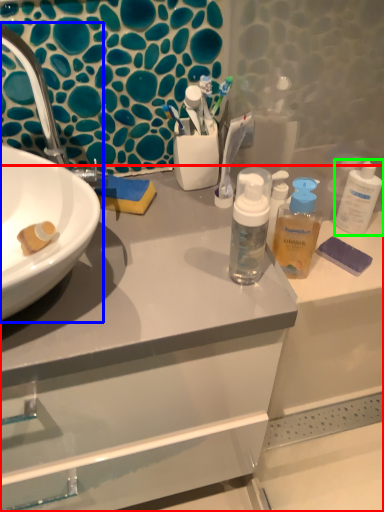
Question: Considering the real-world distances, which object is closest to bathroom cabinet (highlighted by a red box)? sink (highlighted by a blue box) or cleaning product (highlighted by a green box).

Choices:
 (A) sink
 (B) cleaning product

Answer: (A)